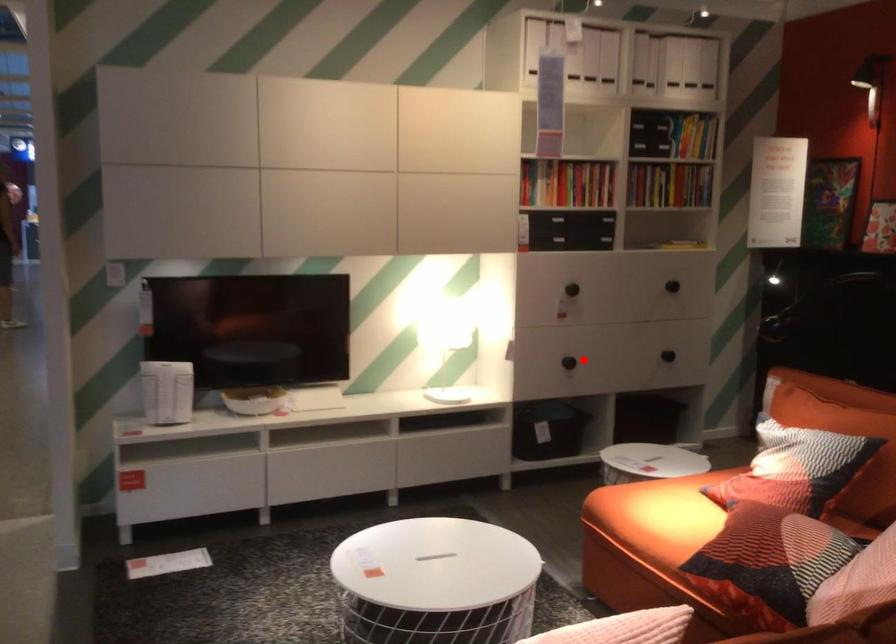
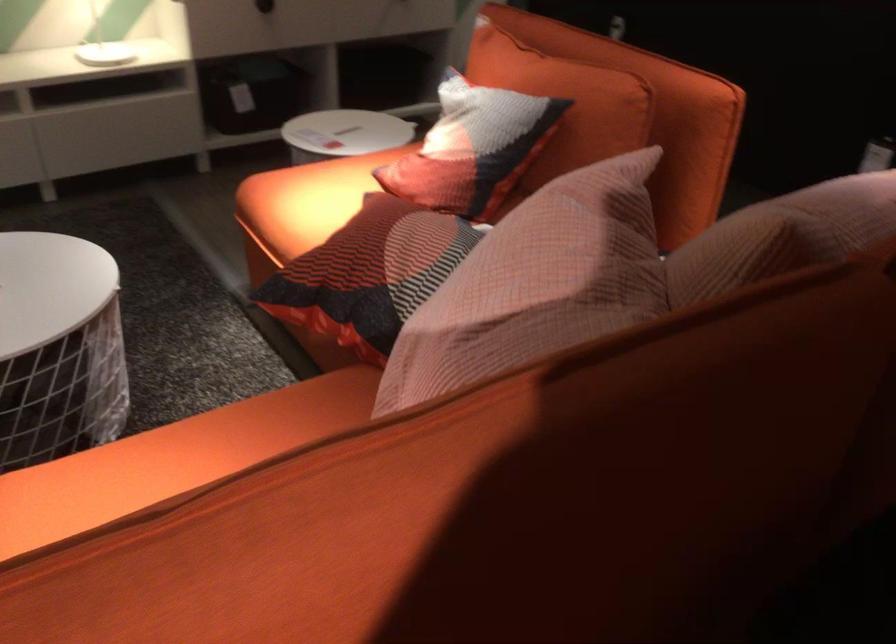
Question: I am providing you with two images of the same scene from different viewpoints. In image1, a red point is highlighted. Considering the same 3D point in image2, which of the following is correct?

Choices:
 (A) It is closer
 (B) It is farther

Answer: (A)